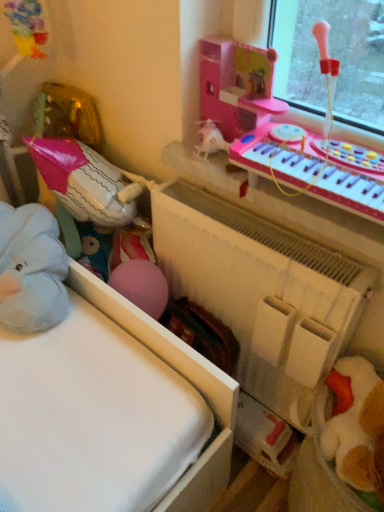
Find the location of a particular element. white matte radiator at center is located at coordinates pos(262,292).

Measure the distance between white matte radiator at center and camera.

white matte radiator at center and camera are 35.16 inches apart.

Describe the element at coordinates (262, 292) in the screenshot. The image size is (384, 512). I see `white matte radiator at center` at that location.

Locate an element on the screen. The width and height of the screenshot is (384, 512). pink plastic musical keyboard at upper right is located at coordinates (315, 167).

This screenshot has width=384, height=512. Describe the element at coordinates (315, 167) in the screenshot. I see `pink plastic musical keyboard at upper right` at that location.

In order to face pink plastic musical keyboard at upper right, should I rotate leftwards or rightwards?

Turn right by 16.813 degrees to look at pink plastic musical keyboard at upper right.

Image resolution: width=384 pixels, height=512 pixels. Find the location of `white matte radiator at center`. white matte radiator at center is located at coordinates (262, 292).

Considering the relative positions of pink plastic musical keyboard at upper right and white matte radiator at center in the image provided, is pink plastic musical keyboard at upper right to the left of white matte radiator at center from the viewer's perspective?

No.

Between pink plastic musical keyboard at upper right and white matte radiator at center, which one is positioned in front?

pink plastic musical keyboard at upper right is closer to the camera.

Is point (266, 130) closer or farther from the camera than point (200, 215)?

Clearly, point (266, 130) is closer to the camera than point (200, 215).

From the image's perspective, is pink plastic musical keyboard at upper right under white matte radiator at center?

No, from the image's perspective, pink plastic musical keyboard at upper right is not below white matte radiator at center.

From a real-world perspective, between pink plastic musical keyboard at upper right and white matte radiator at center, who is vertically lower?

From a 3D spatial view, white matte radiator at center is below.

Considering the sizes of objects pink plastic musical keyboard at upper right and white matte radiator at center in the image provided, who is thinner, pink plastic musical keyboard at upper right or white matte radiator at center?

white matte radiator at center is thinner.

Considering the relative sizes of pink plastic musical keyboard at upper right and white matte radiator at center in the image provided, is pink plastic musical keyboard at upper right taller than white matte radiator at center?

Incorrect, the height of pink plastic musical keyboard at upper right is not larger of that of white matte radiator at center.

Is pink plastic musical keyboard at upper right smaller than white matte radiator at center?

Yes, pink plastic musical keyboard at upper right is smaller than white matte radiator at center.

Is pink plastic musical keyboard at upper right positioned beyond the bounds of white matte radiator at center?

That's correct, pink plastic musical keyboard at upper right is outside of white matte radiator at center.

Looking at this image, are pink plastic musical keyboard at upper right and white matte radiator at center far apart?

They are positioned close to each other.

Is pink plastic musical keyboard at upper right oriented towards white matte radiator at center?

No.

This screenshot has width=384, height=512. I want to click on musical keyboard above the white matte radiator at center (from the image's perspective), so click(315, 167).

Which object is positioned more to the right, white matte radiator at center or pink plastic musical keyboard at upper right?

pink plastic musical keyboard at upper right is more to the right.

Does white matte radiator at center come behind pink plastic musical keyboard at upper right?

That is True.

Is point (172, 185) closer or farther from the camera than point (277, 138)?

Point (172, 185) is positioned farther from the camera compared to point (277, 138).

From the image's perspective, which is above, white matte radiator at center or pink plastic musical keyboard at upper right?

pink plastic musical keyboard at upper right is shown above in the image.

From a real-world perspective, is white matte radiator at center physically below pink plastic musical keyboard at upper right?

Indeed, from a real-world perspective, white matte radiator at center is positioned beneath pink plastic musical keyboard at upper right.

Between white matte radiator at center and pink plastic musical keyboard at upper right, which one has larger width?

pink plastic musical keyboard at upper right is wider.

Does white matte radiator at center have a lesser height compared to pink plastic musical keyboard at upper right?

No, white matte radiator at center is not shorter than pink plastic musical keyboard at upper right.

Can you confirm if white matte radiator at center is smaller than pink plastic musical keyboard at upper right?

No.

Based on the photo, would you say white matte radiator at center is outside pink plastic musical keyboard at upper right?

Absolutely, white matte radiator at center is external to pink plastic musical keyboard at upper right.

Are white matte radiator at center and pink plastic musical keyboard at upper right located far from each other?

That's not correct — white matte radiator at center is a little close to pink plastic musical keyboard at upper right.

Is white matte radiator at center aimed at pink plastic musical keyboard at upper right?

No, white matte radiator at center is not facing towards pink plastic musical keyboard at upper right.

How many degrees apart are the facing directions of white matte radiator at center and pink plastic musical keyboard at upper right?

The facing directions of white matte radiator at center and pink plastic musical keyboard at upper right are 2.59 degrees apart.

How distant is white matte radiator at center from pink plastic musical keyboard at upper right?

white matte radiator at center and pink plastic musical keyboard at upper right are 10.99 inches apart.

You are a GUI agent. You are given a task and a screenshot of the screen. Output one action in this format:
    pyautogui.click(x=<x>, y=<y>)
    Task: Click on the radiator that is on the left side of pink plastic musical keyboard at upper right
    The width and height of the screenshot is (384, 512).
    Given the screenshot: What is the action you would take?
    pos(262,292)

The image size is (384, 512). Find the location of `radiator lying behind the pink plastic musical keyboard at upper right`. radiator lying behind the pink plastic musical keyboard at upper right is located at coordinates (262, 292).

Where is `musical keyboard that is on the right side of white matte radiator at center`? Image resolution: width=384 pixels, height=512 pixels. musical keyboard that is on the right side of white matte radiator at center is located at coordinates pos(315,167).